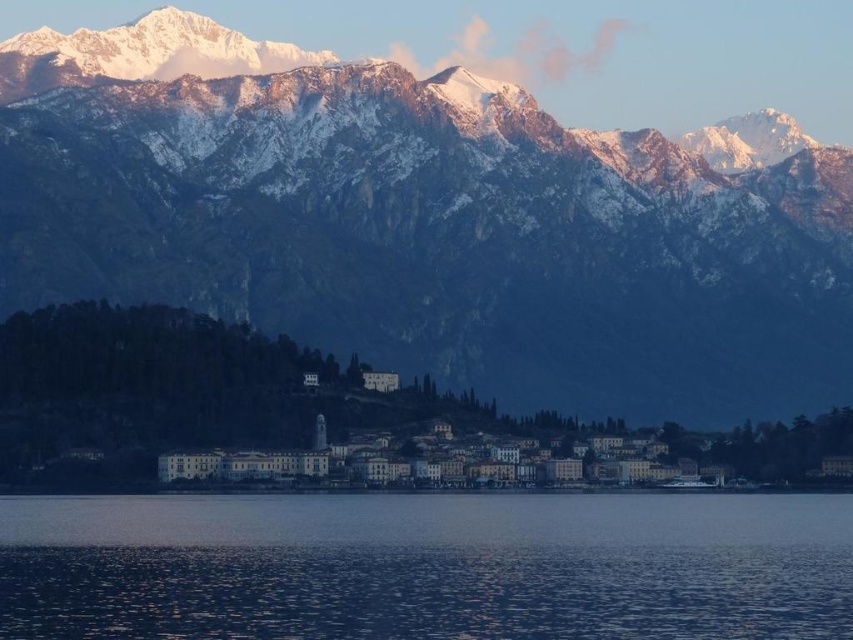
Which of these two, snowy rock mountain range at upper center or blue water at lower center, stands taller?

With more height is snowy rock mountain range at upper center.

Can you confirm if snowy rock mountain range at upper center is bigger than blue water at lower center?

Yes.

Is point (456, 256) farther from camera compared to point (508, 557)?

No, (456, 256) is in front of (508, 557).

Locate an element on the screen. The image size is (853, 640). snowy rock mountain range at upper center is located at coordinates tap(426, 221).